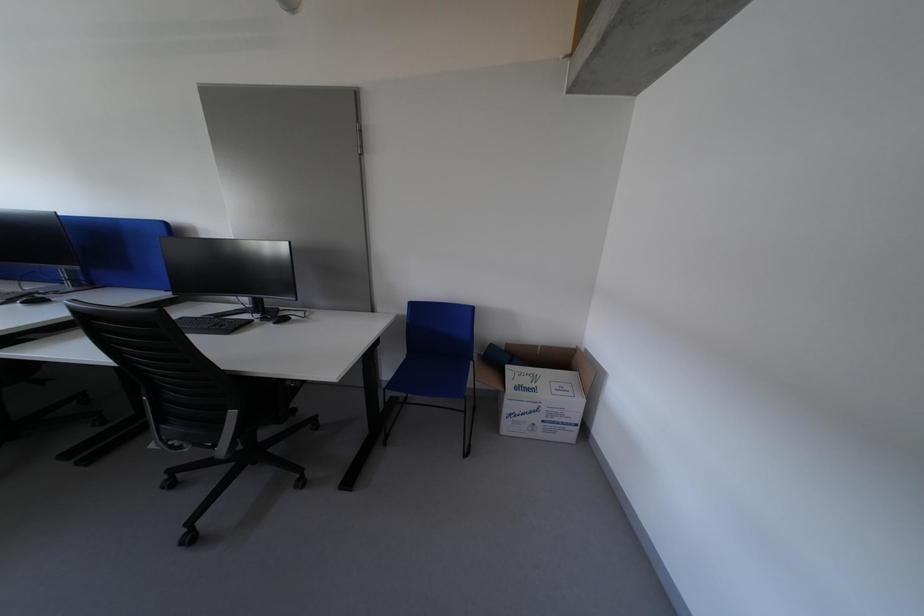
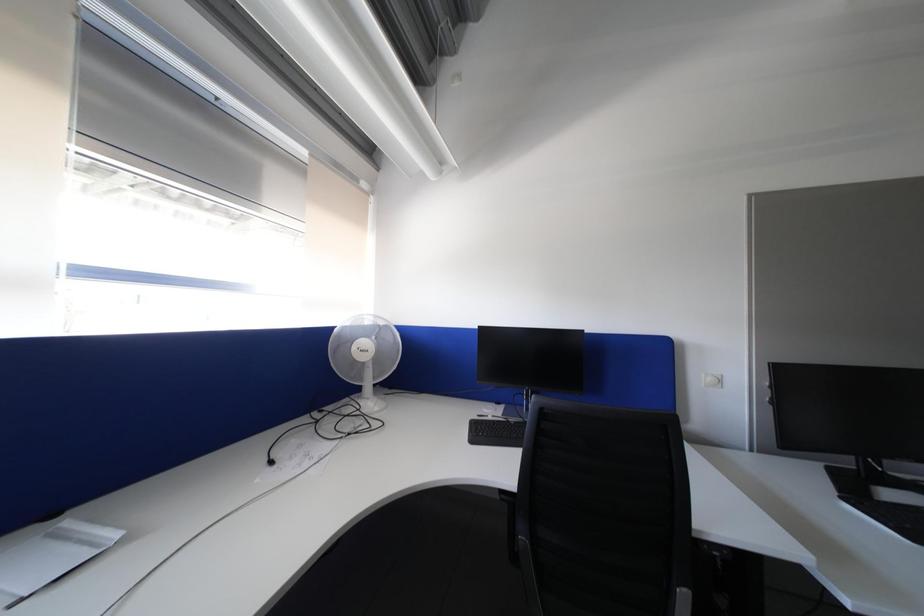
Question: The images are taken continuously from a first-person perspective. In which direction are you moving?

Choices:
 (A) Left
 (B) Right
 (C) Forward
 (D) Backward

Answer: (A)